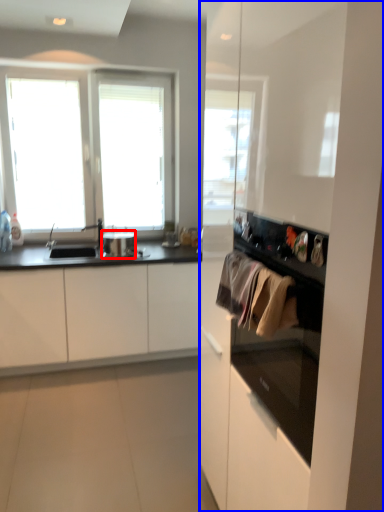
Question: Which object appears closest to the camera in this image, appliance (highlighted by a red box) or dresser (highlighted by a blue box)?

Choices:
 (A) appliance
 (B) dresser

Answer: (B)